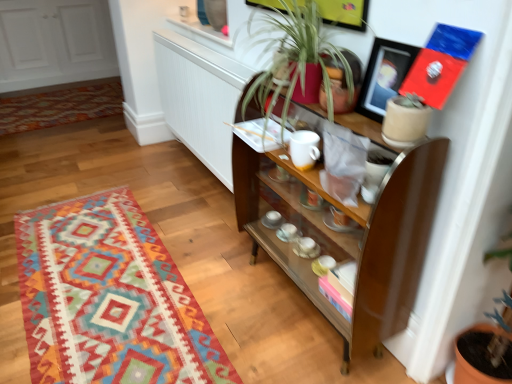
Question: From the image's perspective, is textured wool rug at lower left, which is the second mat in top-to-bottom order, on top of multicolored woven rug at lower left, which is counted as the 1th mat, starting from the top?

Choices:
 (A) no
 (B) yes

Answer: (A)

Question: Considering the relative sizes of textured wool rug at lower left, the 2th mat when ordered from back to front, and multicolored woven rug at lower left, the first mat when ordered from back to front, in the image provided, is textured wool rug at lower left, the 2th mat when ordered from back to front, smaller than multicolored woven rug at lower left, the first mat when ordered from back to front,?

Choices:
 (A) yes
 (B) no

Answer: (A)

Question: Considering the relative positions of textured wool rug at lower left, the 2th mat when ordered from back to front, and multicolored woven rug at lower left, positioned as the second mat in front-to-back order, in the image provided, is textured wool rug at lower left, the 2th mat when ordered from back to front, to the right of multicolored woven rug at lower left, positioned as the second mat in front-to-back order, from the viewer's perspective?

Choices:
 (A) no
 (B) yes

Answer: (B)

Question: Could you tell me if textured wool rug at lower left, which is the second mat in top-to-bottom order, is turned towards multicolored woven rug at lower left, which is counted as the 1th mat, starting from the top?

Choices:
 (A) no
 (B) yes

Answer: (A)

Question: From a real-world perspective, is textured wool rug at lower left, the 2th mat when ordered from back to front, under multicolored woven rug at lower left, positioned as the second mat in front-to-back order?

Choices:
 (A) yes
 (B) no

Answer: (A)

Question: Is textured wool rug at lower left, the 2th mat when ordered from back to front, outside multicolored woven rug at lower left, the first mat when ordered from back to front?

Choices:
 (A) no
 (B) yes

Answer: (B)

Question: From a real-world perspective, is brown wooden shelf at center located higher than textured wool rug at lower left, which is the second mat in top-to-bottom order?

Choices:
 (A) yes
 (B) no

Answer: (A)

Question: Does brown wooden shelf at center have a smaller size compared to textured wool rug at lower left, which ranks as the 1th mat in bottom-to-top order?

Choices:
 (A) no
 (B) yes

Answer: (A)

Question: Is brown wooden shelf at center not near textured wool rug at lower left, the 2th mat when ordered from back to front?

Choices:
 (A) yes
 (B) no

Answer: (B)

Question: Is brown wooden shelf at center at the right side of textured wool rug at lower left, the 2th mat when ordered from back to front?

Choices:
 (A) yes
 (B) no

Answer: (A)

Question: Would you say brown wooden shelf at center is outside textured wool rug at lower left, which is the second mat in top-to-bottom order?

Choices:
 (A) yes
 (B) no

Answer: (A)

Question: Can you confirm if brown wooden shelf at center is positioned to the left of textured wool rug at lower left, placed as the 1th mat when sorted from front to back?

Choices:
 (A) yes
 (B) no

Answer: (B)

Question: Is textured wool rug at lower left, which is the second mat in top-to-bottom order, oriented away from brown wooden shelf at center?

Choices:
 (A) no
 (B) yes

Answer: (A)